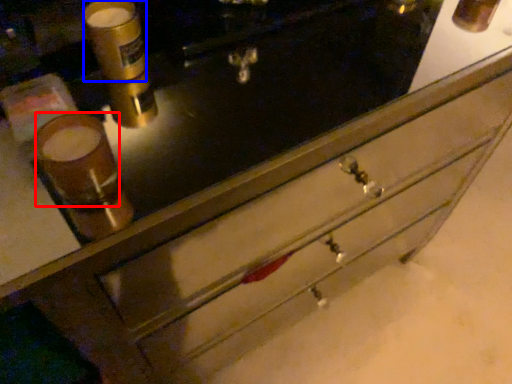
Question: Which point is closer to the camera, beverage (highlighted by a red box) or beverage (highlighted by a blue box)?

Choices:
 (A) beverage
 (B) beverage

Answer: (A)